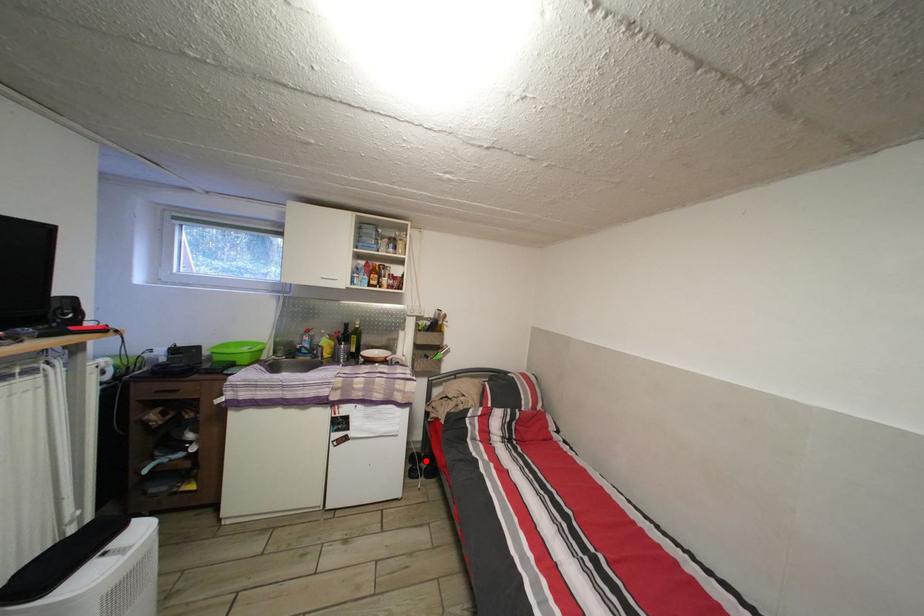
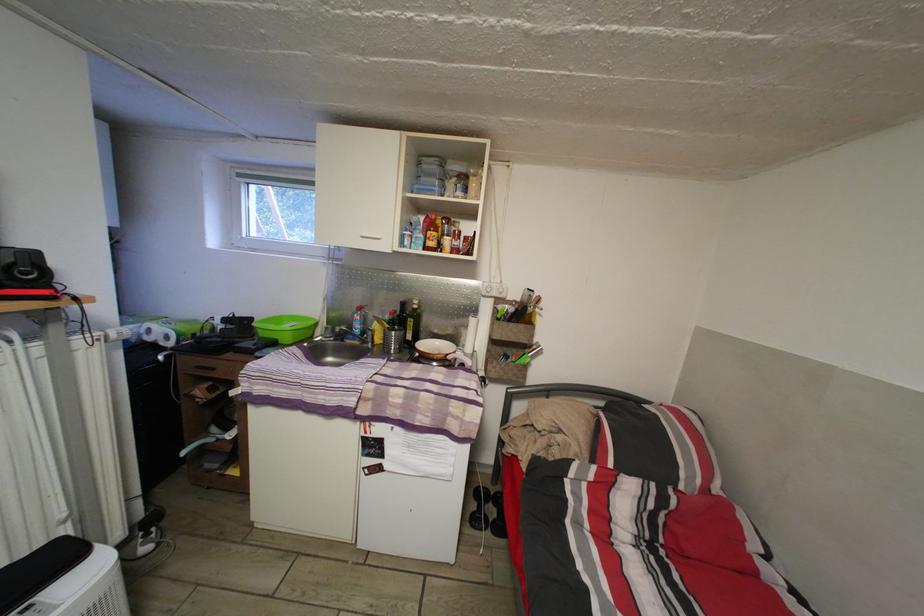
Locate, in the second image, the point that corresponds to the highlighted location in the first image.

(493, 498)